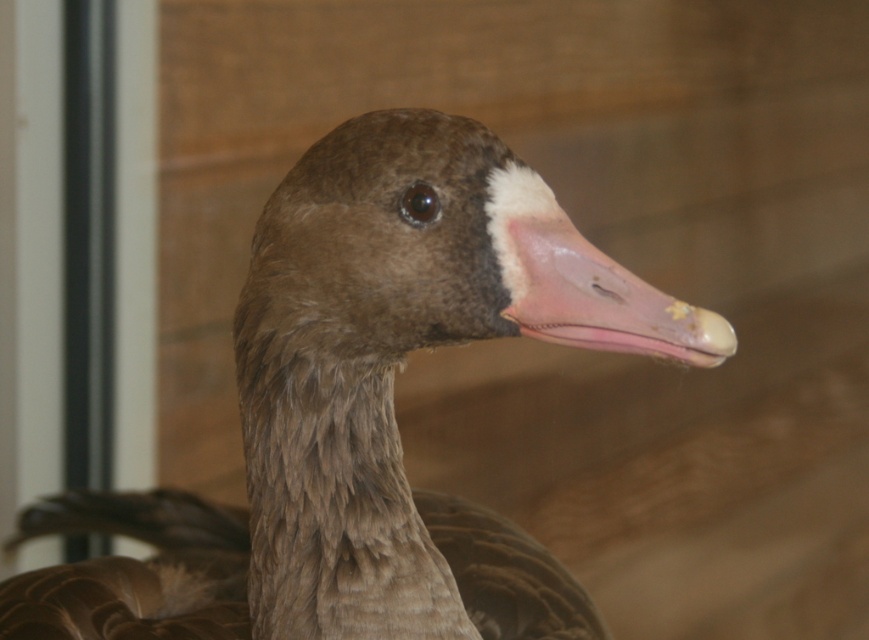
You are a photographer aiming to capture a closeup of the brown feathered duck at center. If your camera is focused at point 0.6, 0.4, will the duck be in focus?

The brown feathered duck at center is located at point (363, 410), which is very close to the camera focus point of (347, 384). Depending on the camera aperture, the duck may be in focus or slightly out of focus. However, the distance is minimal, so it is likely within the depth of field.

You are a photographer trying to capture the brown feathered duck at center and the pink matte beak at center in a single frame. Based on their sizes, do you think both can fit within the camera frame if the duck is positioned centrally?

The brown feathered duck at center might be wider than the pink matte beak at center, so it is possible that the duck could occupy more space in the frame, but both should still fit as the beak is part of the duck.